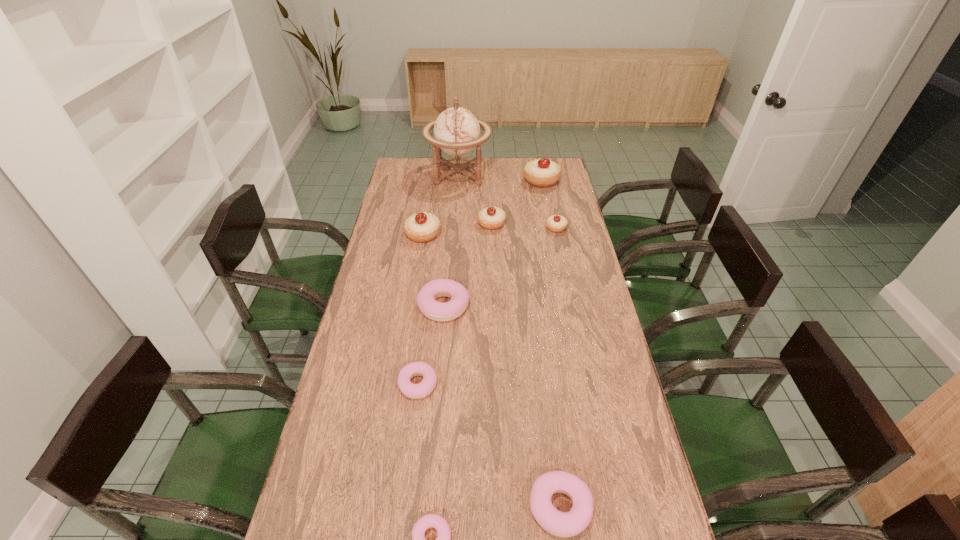
At what (x,y) coordinates should I click in order to perform the action: click on pastry located at the far edge. Please return your answer as a coordinate pair (x, y). The image size is (960, 540). Looking at the image, I should click on (543, 172).

In order to click on globe present at the left edge in this screenshot , I will do `click(456, 130)`.

At what (x,y) coordinates should I click in order to perform the action: click on pastry that is at the left edge. Please return your answer as a coordinate pair (x, y). Looking at the image, I should click on (422, 227).

I want to click on object situated at the far left corner, so click(x=456, y=130).

I want to click on object present at the far right corner, so click(543, 172).

You are a GUI agent. You are given a task and a screenshot of the screen. Output one action in this format:
    pyautogui.click(x=<x>, y=<y>)
    Task: Click on the vacant point at the far edge
    The width and height of the screenshot is (960, 540).
    Given the screenshot: What is the action you would take?
    pyautogui.click(x=522, y=162)

The width and height of the screenshot is (960, 540). Find the location of `vacant area at the left edge`. vacant area at the left edge is located at coordinates (347, 349).

At what (x,y) coordinates should I click in order to perform the action: click on blank space at the right edge. Please return your answer as a coordinate pair (x, y). Image resolution: width=960 pixels, height=540 pixels. Looking at the image, I should click on (564, 213).

In the image, there is a desktop. Where is `blank space at the far left corner`? This screenshot has width=960, height=540. blank space at the far left corner is located at coordinates (411, 172).

Locate an element on the screen. This screenshot has height=540, width=960. free area in between the fourth nearest object and the farthest pastry is located at coordinates [492, 244].